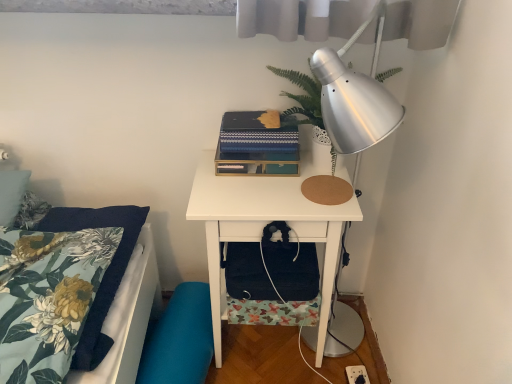
Find the location of a particular element. vacant region above white matte nightstand at center (from a real-world perspective) is located at coordinates (284, 179).